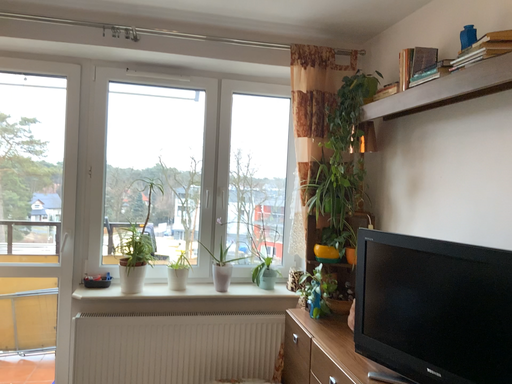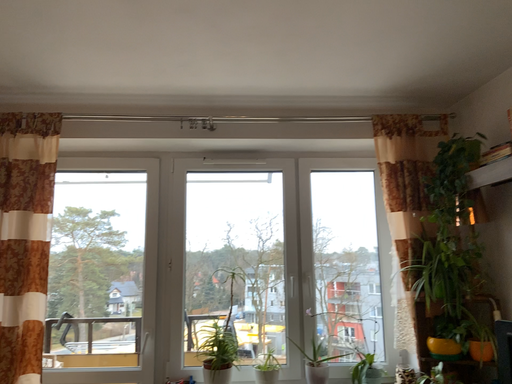
Question: Which way did the camera rotate in the video?

Choices:
 (A) rotated left
 (B) rotated right

Answer: (A)